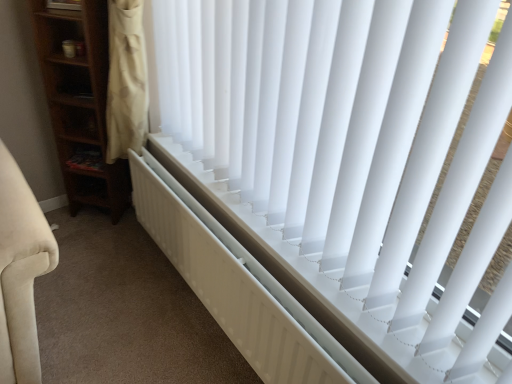
Question: Can you confirm if white plastic blinds at center is positioned to the left of white matte radiator at center?

Choices:
 (A) yes
 (B) no

Answer: (B)

Question: From a real-world perspective, is white plastic blinds at center over white matte radiator at center?

Choices:
 (A) no
 (B) yes

Answer: (B)

Question: From the image's perspective, does white plastic blinds at center appear lower than white matte radiator at center?

Choices:
 (A) yes
 (B) no

Answer: (B)

Question: From a real-world perspective, does white plastic blinds at center sit lower than white matte radiator at center?

Choices:
 (A) no
 (B) yes

Answer: (A)

Question: Is white plastic blinds at center positioned in front of white matte radiator at center?

Choices:
 (A) yes
 (B) no

Answer: (A)

Question: Considering the relative sizes of white plastic blinds at center and white matte radiator at center in the image provided, is white plastic blinds at center wider than white matte radiator at center?

Choices:
 (A) no
 (B) yes

Answer: (B)

Question: Does white plastic blinds at center lie in front of wooden shelf at left?

Choices:
 (A) no
 (B) yes

Answer: (B)

Question: Is white plastic blinds at center not close to wooden shelf at left?

Choices:
 (A) yes
 (B) no

Answer: (A)

Question: Is white plastic blinds at center smaller than wooden shelf at left?

Choices:
 (A) no
 (B) yes

Answer: (A)

Question: Is white plastic blinds at center to the left of wooden shelf at left from the viewer's perspective?

Choices:
 (A) no
 (B) yes

Answer: (A)

Question: Considering the relative positions of white plastic blinds at center and wooden shelf at left in the image provided, is white plastic blinds at center behind wooden shelf at left?

Choices:
 (A) yes
 (B) no

Answer: (B)

Question: Is white plastic blinds at center looking in the opposite direction of wooden shelf at left?

Choices:
 (A) yes
 (B) no

Answer: (B)

Question: Is wooden shelf at left far from white matte radiator at center?

Choices:
 (A) yes
 (B) no

Answer: (B)